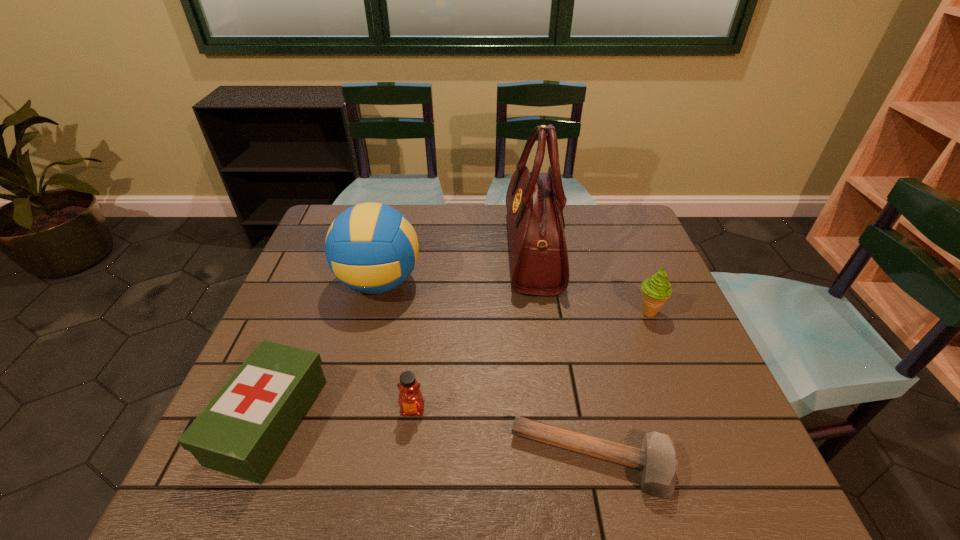
At what (x,y) coordinates should I click in order to perform the action: click on icecream that is at the right edge. Please return your answer as a coordinate pair (x, y). The height and width of the screenshot is (540, 960). Looking at the image, I should click on (656, 290).

Identify the location of mallet that is at the right edge. Image resolution: width=960 pixels, height=540 pixels. (657, 461).

Identify the location of object situated at the near left corner. (242, 431).

The width and height of the screenshot is (960, 540). I want to click on object that is at the near right corner, so click(x=657, y=461).

The image size is (960, 540). I want to click on free space at the near edge of the desktop, so click(x=551, y=458).

Where is `free space at the left edge of the desktop`? This screenshot has height=540, width=960. free space at the left edge of the desktop is located at coordinates (315, 254).

Identify the location of vacant space at the right edge. (620, 277).

This screenshot has height=540, width=960. I want to click on free space between the mallet and the honey, so click(502, 435).

At what (x,y) coordinates should I click in order to perform the action: click on free point between the first-aid kit and the honey. Please return your answer as a coordinate pair (x, y). Image resolution: width=960 pixels, height=540 pixels. Looking at the image, I should click on (341, 415).

Where is `free space between the rightmost object and the second tallest object`? free space between the rightmost object and the second tallest object is located at coordinates (514, 297).